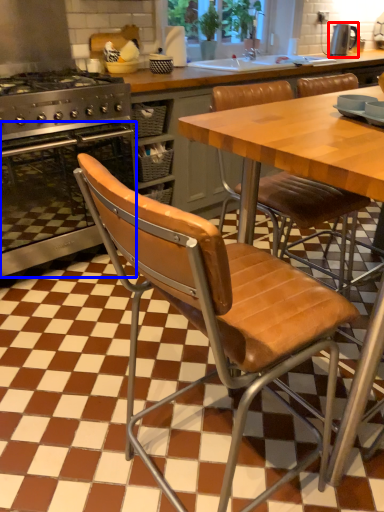
Question: Which point is further to the camera, kitchen appliance (highlighted by a red box) or oven (highlighted by a blue box)?

Choices:
 (A) kitchen appliance
 (B) oven

Answer: (A)